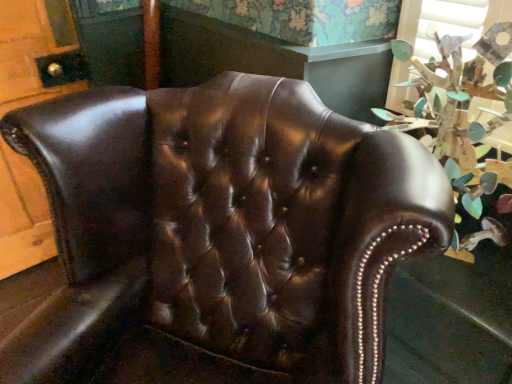
Question: Is point (143, 281) positioned closer to the camera than point (489, 168)?

Choices:
 (A) closer
 (B) farther

Answer: (B)

Question: Choose the correct answer: Is shiny brown leather chair at center inside green leafy plant at upper right or outside it?

Choices:
 (A) outside
 (B) inside

Answer: (A)

Question: From a real-world perspective, is shiny brown leather chair at center physically located above or below green leafy plant at upper right?

Choices:
 (A) above
 (B) below

Answer: (B)

Question: Is green leafy plant at upper right bigger or smaller than shiny brown leather chair at center?

Choices:
 (A) small
 (B) big

Answer: (A)

Question: Considering the positions of green leafy plant at upper right and shiny brown leather chair at center in the image, is green leafy plant at upper right taller or shorter than shiny brown leather chair at center?

Choices:
 (A) short
 (B) tall

Answer: (A)

Question: Is point (484, 36) positioned closer to the camera than point (117, 213)?

Choices:
 (A) farther
 (B) closer

Answer: (B)

Question: From a real-world perspective, is green leafy plant at upper right above or below shiny brown leather chair at center?

Choices:
 (A) above
 (B) below

Answer: (A)